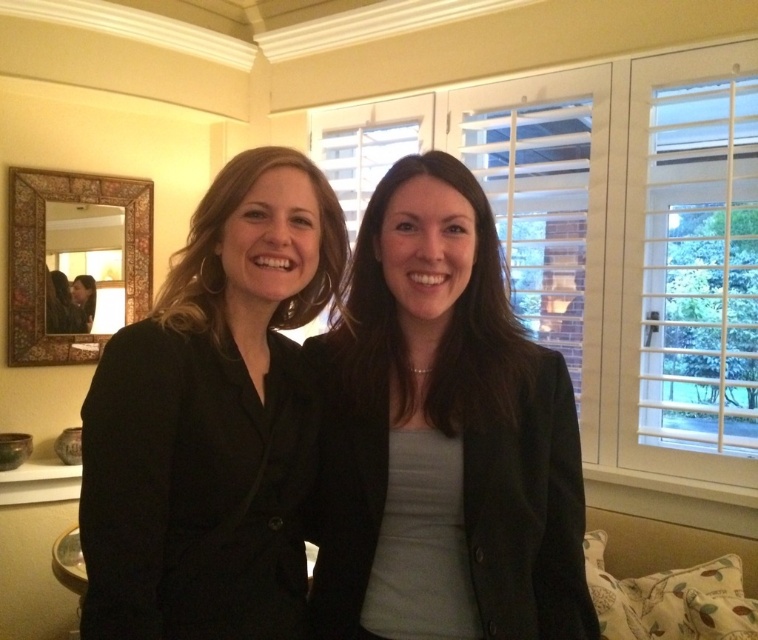
You are a photographer adjusting the camera focus. You need to ensure that both the black matte blazer at left and the matte black blazer at center are in focus. The camera can only focus on objects within a 10 inch range. Can both blazers be in focus at the same time?

The black matte blazer at left is 8.62 inches from matte black blazer at center. Since the distance between them is within the 10 inch range, both can be in focus simultaneously.

You are standing in the room and want to move from the point at coordinates point (x=236, y=596) to the point at coordinates point (x=334, y=384). Which direction should you move to get closer to your destination?

Since point (x=236, y=596) is in front of point (x=334, y=384), you should move backward to reach the destination point (x=334, y=384).